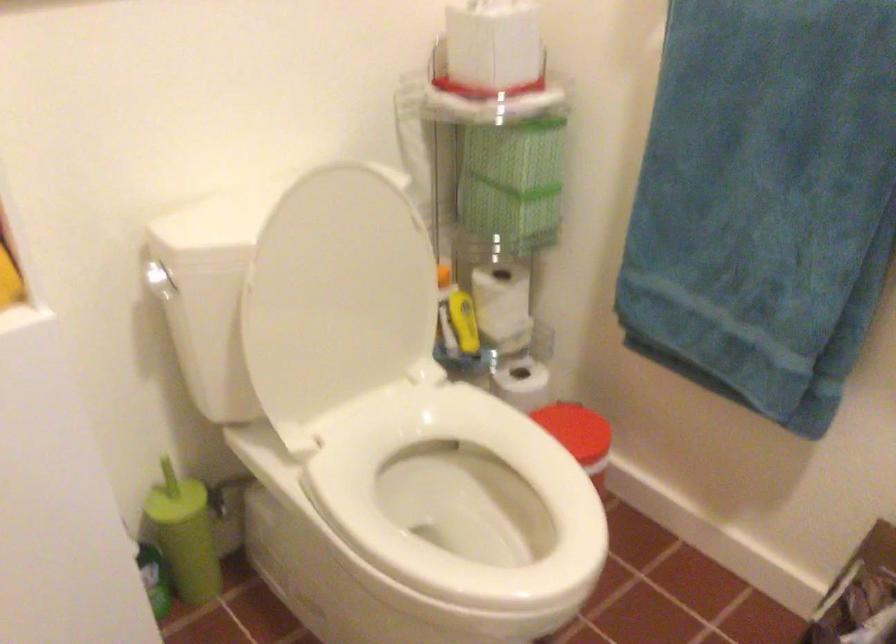
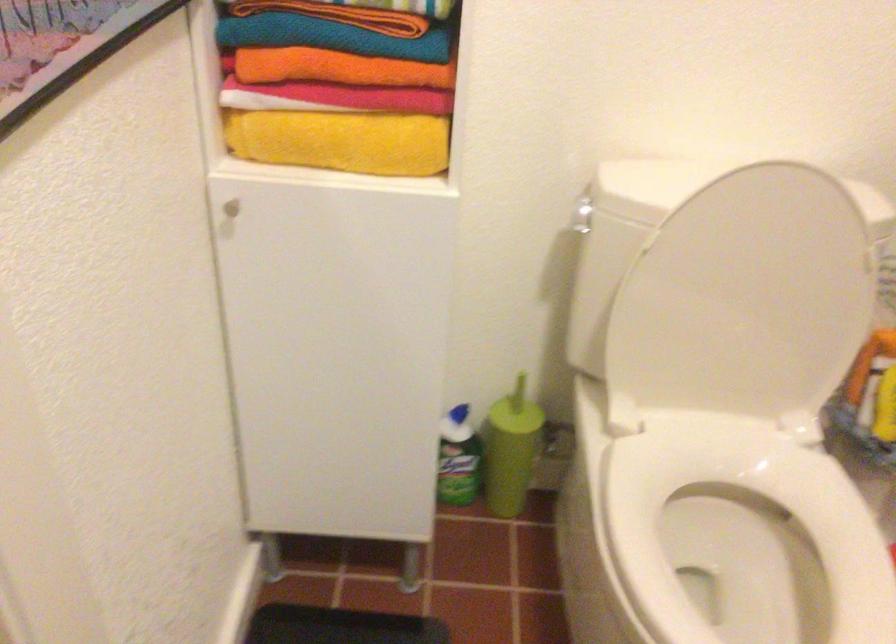
In the second image, find the point that corresponds to (x=342, y=292) in the first image.

(744, 299)